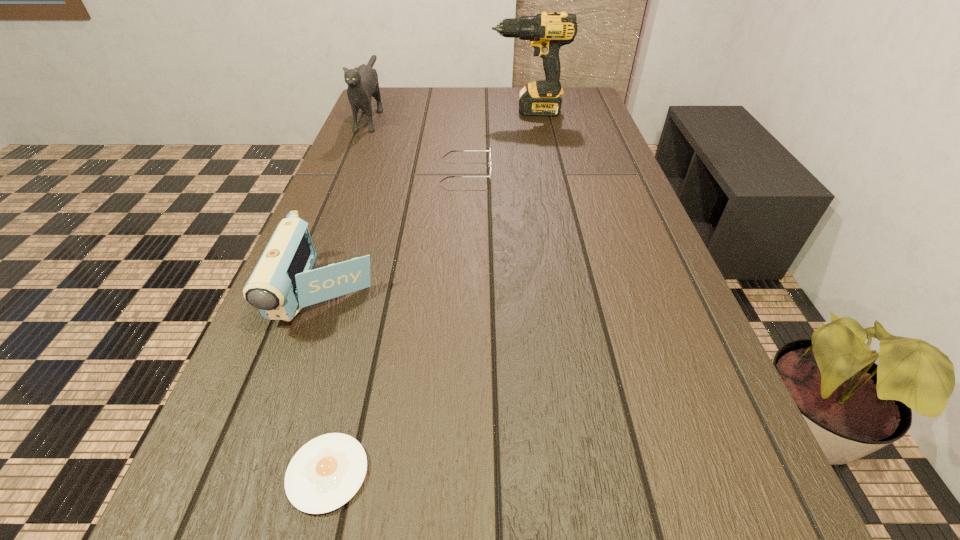
Find the location of a particular element. egg yolk located in the left edge section of the desktop is located at coordinates (325, 473).

You are a GUI agent. You are given a task and a screenshot of the screen. Output one action in this format:
    pyautogui.click(x=<x>, y=<y>)
    Task: Click on the object positioned at the right edge
    The height and width of the screenshot is (540, 960).
    Given the screenshot: What is the action you would take?
    pyautogui.click(x=547, y=32)

Identify the location of object that is at the far left corner. The image size is (960, 540). (362, 81).

You are a GUI agent. You are given a task and a screenshot of the screen. Output one action in this format:
    pyautogui.click(x=<x>, y=<y>)
    Task: Click on the object that is positioned at the far right corner
    
    Given the screenshot: What is the action you would take?
    pyautogui.click(x=547, y=32)

At what (x,y) coordinates should I click in order to perform the action: click on vacant region at the far edge of the desktop. Please return your answer as a coordinate pair (x, y). Image resolution: width=960 pixels, height=540 pixels. Looking at the image, I should click on (468, 95).

Locate an element on the screen. The width and height of the screenshot is (960, 540). vacant area at the left edge of the desktop is located at coordinates (337, 349).

Where is `free space at the right edge`? The image size is (960, 540). free space at the right edge is located at coordinates (710, 513).

This screenshot has width=960, height=540. I want to click on vacant space at the far left corner of the desktop, so click(x=398, y=104).

The height and width of the screenshot is (540, 960). What are the coordinates of `vacant space at the far right corner` in the screenshot? It's located at (575, 91).

Find the location of a particular element. The width and height of the screenshot is (960, 540). blank region between the nearest object and the third shortest object is located at coordinates (327, 383).